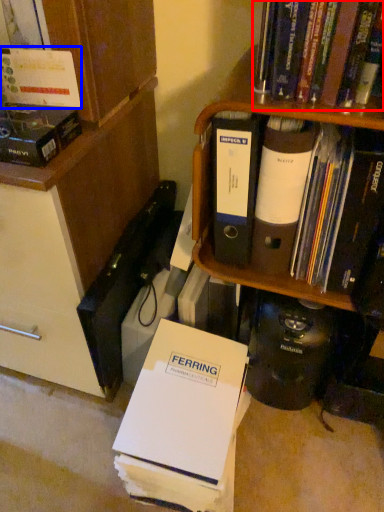
Question: Which point is closer to the camera, book (highlighted by a red box) or book (highlighted by a blue box)?

Choices:
 (A) book
 (B) book

Answer: (A)